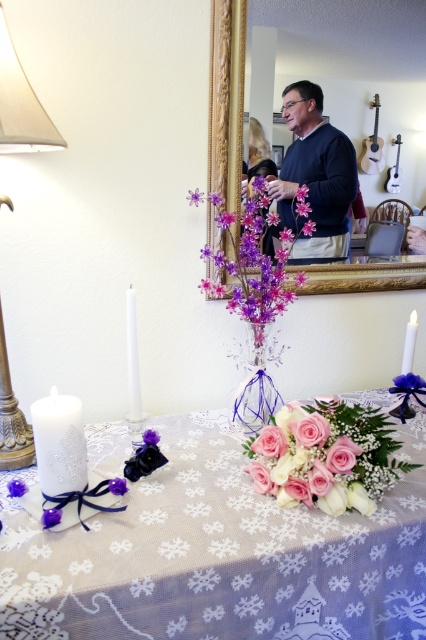
Question: Is the position of purple floral arrangement at center more distant than that of white matte candle at right?

Choices:
 (A) yes
 (B) no

Answer: (B)

Question: Which of the following is the closest to the observer?

Choices:
 (A) (60, 476)
 (B) (226, 16)
 (C) (408, 490)
 (D) (296, 244)

Answer: (A)

Question: Which object appears closest to the camera in this image?

Choices:
 (A) dark blue sweater at center
 (B) matte gold lamp at left

Answer: (B)

Question: Is dark blue sweater at center thinner than purple fabric flower at lower left?

Choices:
 (A) no
 (B) yes

Answer: (A)

Question: Does white lace tablecloth at center have a greater width compared to gold-framed mirror at upper center?

Choices:
 (A) yes
 (B) no

Answer: (A)

Question: Which object is the closest to the matte purple floral arrangement at center?

Choices:
 (A) dark blue sweater at center
 (B) white wax candle at lower left
 (C) pink matte roses at center
 (D) white glossy candle at lower left

Answer: (A)